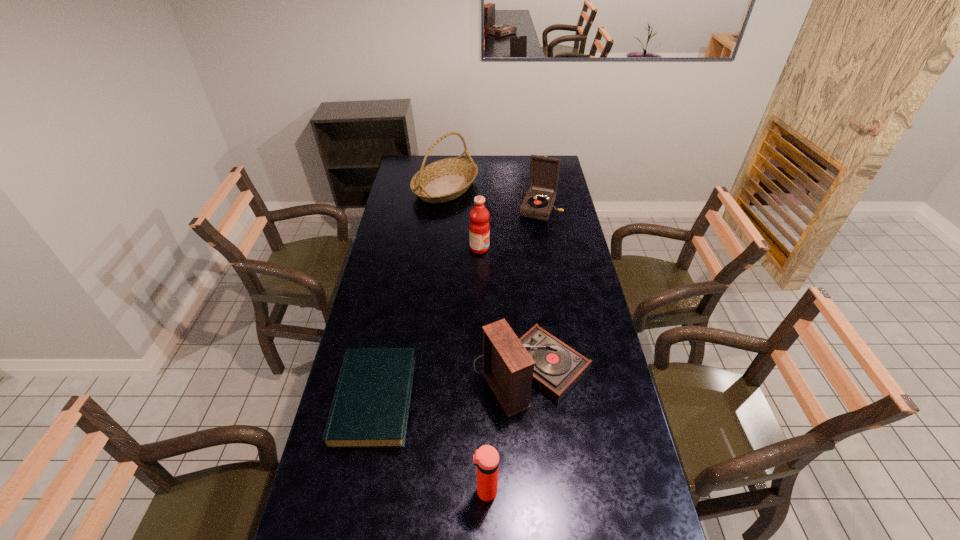
You are a GUI agent. You are given a task and a screenshot of the screen. Output one action in this format:
    pyautogui.click(x=<x>, y=<y>)
    Task: Click on the vacant space located on the right of the thermos bottle
    
    Given the screenshot: What is the action you would take?
    pyautogui.click(x=636, y=491)

I want to click on free space located on the front of the shortest object, so click(348, 528).

The image size is (960, 540). Find the location of `object present at the far edge`. object present at the far edge is located at coordinates (444, 180).

Identify the location of basket present at the left edge. pos(444,180).

Find the location of `book that is positioned at the left edge`. book that is positioned at the left edge is located at coordinates (370, 408).

At what (x,y) coordinates should I click in order to perform the action: click on object that is positioned at the far left corner. Please return your answer as a coordinate pair (x, y). Image resolution: width=960 pixels, height=540 pixels. Looking at the image, I should click on (444, 180).

In the image, there is a desktop. Find the location of `free region at the left edge`. free region at the left edge is located at coordinates (384, 336).

Where is `vacant point located between the nearer phonograph record and the third farthest object`? vacant point located between the nearer phonograph record and the third farthest object is located at coordinates (506, 310).

In order to click on free point between the shortest object and the nearer phonograph record in this screenshot , I will do `click(453, 386)`.

Where is `free space that is in between the fourth nearest object and the basket`? free space that is in between the fourth nearest object and the basket is located at coordinates (463, 218).